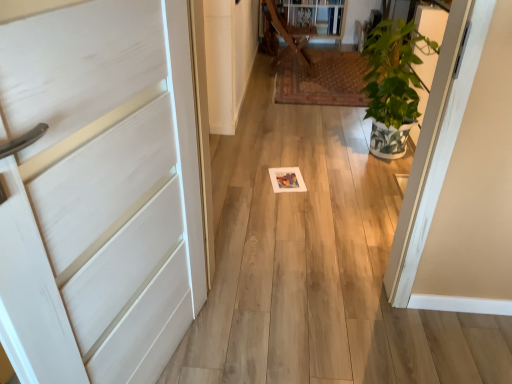
Question: Considering their positions, is green leafy plant at right located in front of or behind white matte door at left?

Choices:
 (A) front
 (B) behind

Answer: (B)

Question: From the image's perspective, is green leafy plant at right located above or below white matte door at left?

Choices:
 (A) above
 (B) below

Answer: (A)

Question: Considering the real-world distances, which object is farthest from the green leafy plant at right?

Choices:
 (A) white matte door at left
 (B) wooden at center

Answer: (A)

Question: Considering the real-world distances, which object is farthest from the wooden at center?

Choices:
 (A) green leafy plant at right
 (B) white matte door at left

Answer: (B)